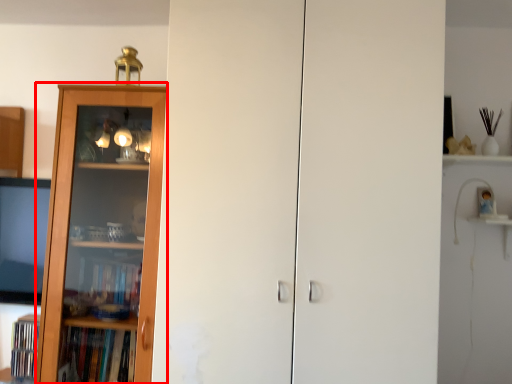
Question: From the image's perspective, considering the relative positions of bookcase (annotated by the red box) and screen door in the image provided, where is bookcase (annotated by the red box) located with respect to the staircase?

Choices:
 (A) below
 (B) above

Answer: (A)